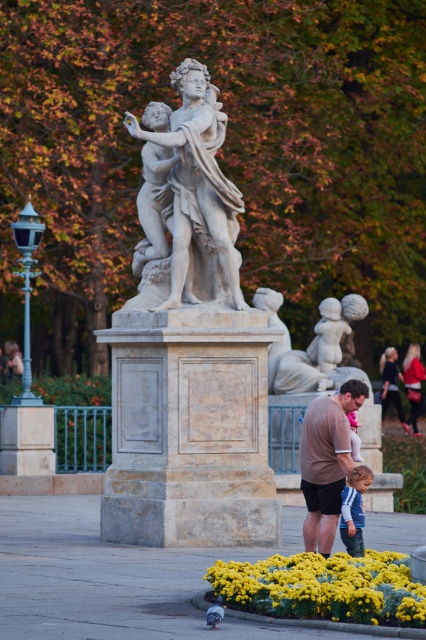
Question: Which of the following is the closest to the observer?

Choices:
 (A) (347, 444)
 (B) (370, 598)

Answer: (B)

Question: Which of the following is the farthest from the observer?

Choices:
 (A) matte brown shirt at center
 (B) white marble statue at center
 (C) gray matte pigeon at lower center

Answer: (B)

Question: Considering the relative positions of dark blue fabric dress at lower right and gray matte pigeon at lower center in the image provided, where is dark blue fabric dress at lower right located with respect to gray matte pigeon at lower center?

Choices:
 (A) right
 (B) left

Answer: (A)

Question: Which point appears closest to the camera in this image?

Choices:
 (A) (322, 397)
 (B) (379, 580)

Answer: (B)

Question: Is yellow matte flowers at lower center positioned before blue striped shirt at lower center?

Choices:
 (A) no
 (B) yes

Answer: (B)

Question: Does yellow matte flowers at lower center have a greater width compared to matte brown shirt at center?

Choices:
 (A) no
 (B) yes

Answer: (B)